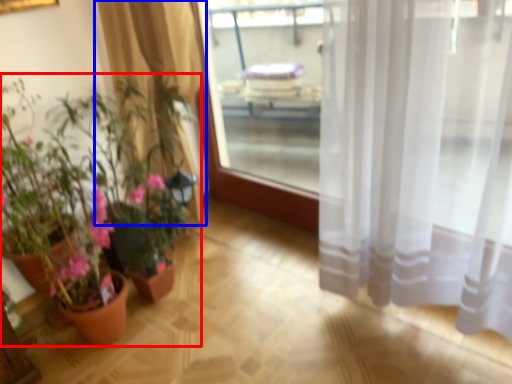
Question: Which point is further to the camera, houseplant (highlighted by a red box) or curtain (highlighted by a blue box)?

Choices:
 (A) houseplant
 (B) curtain

Answer: (B)